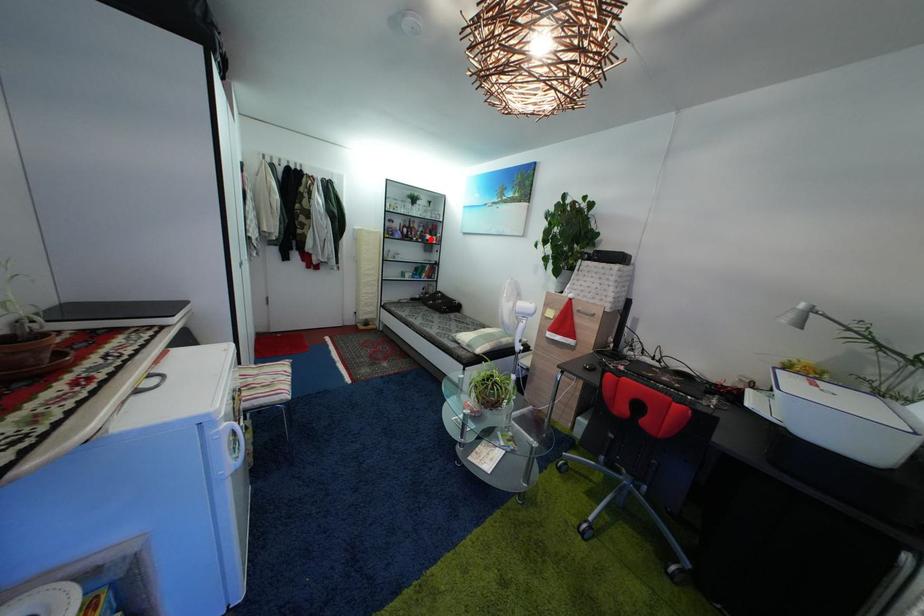
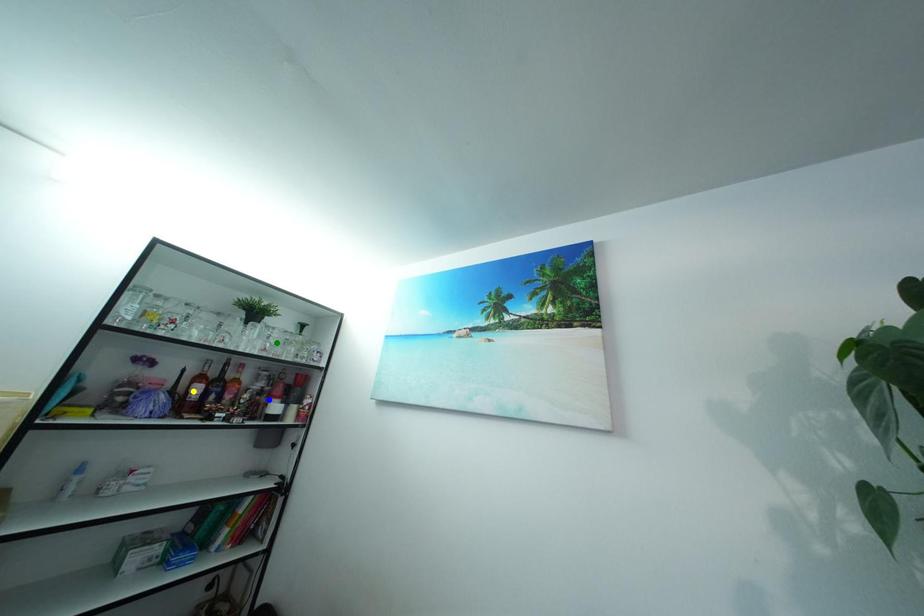
Question: I am providing you with two images of the same scene from different viewpoints. A red point is marked on the first image. You are given multiple points on the second image. Which spot in image 2 lines up with the point in image 1?

Choices:
 (A) blue point
 (B) yellow point
 (C) green point

Answer: (A)